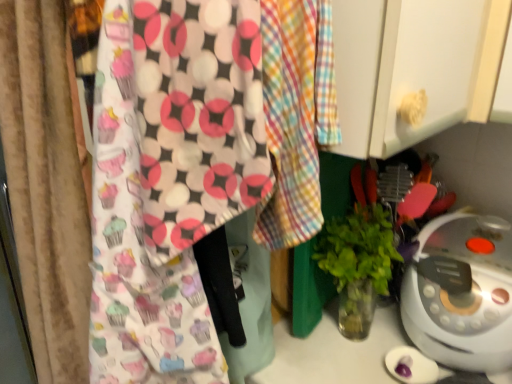
What do you see at coordinates (358, 264) in the screenshot? I see `green leafy plant in clear glass vase at center-right` at bounding box center [358, 264].

Based on the photo, what is the approximate height of white plastic rice cooker at lower right?

white plastic rice cooker at lower right is 10.87 inches in height.

Identify the location of cupcake-patterned fabric at center. The image size is (512, 384). (170, 178).

Is white plastic rice cooker at lower right to the left or to the right of cupcake-patterned fabric at center in the image?

Clearly, white plastic rice cooker at lower right is on the right of cupcake-patterned fabric at center in the image.

Would you consider white plastic rice cooker at lower right to be distant from cupcake-patterned fabric at center?

No, white plastic rice cooker at lower right is not far away from cupcake-patterned fabric at center.

Between white plastic rice cooker at lower right and cupcake-patterned fabric at center, which one is positioned behind?

white plastic rice cooker at lower right is further from the camera.

Considering the relative positions of cupcake-patterned fabric at center and white plastic rice cooker at lower right in the image provided, is cupcake-patterned fabric at center to the left of white plastic rice cooker at lower right from the viewer's perspective?

Indeed, cupcake-patterned fabric at center is positioned on the left side of white plastic rice cooker at lower right.

Which object is closer to the camera taking this photo, cupcake-patterned fabric at center or white plastic rice cooker at lower right?

Positioned in front is cupcake-patterned fabric at center.

Does cupcake-patterned fabric at center have a larger size compared to white plastic rice cooker at lower right?

Yes.

From the image's perspective, is cupcake-patterned fabric at center above or below white plastic rice cooker at lower right?

cupcake-patterned fabric at center is situated higher than white plastic rice cooker at lower right in the image.

Which is more to the right, green leafy plant in clear glass vase at center-right or cupcake-patterned fabric at center?

Positioned to the right is green leafy plant in clear glass vase at center-right.

From a real-world perspective, is green leafy plant in clear glass vase at center-right positioned under cupcake-patterned fabric at center based on gravity?

Yes, from a real-world perspective, green leafy plant in clear glass vase at center-right is below cupcake-patterned fabric at center.

I want to click on wrapping paper located in front of the green leafy plant in clear glass vase at center-right, so click(x=170, y=178).

In terms of width, does green leafy plant in clear glass vase at center-right look wider or thinner when compared to cupcake-patterned fabric at center?

Clearly, green leafy plant in clear glass vase at center-right has less width compared to cupcake-patterned fabric at center.

Between green leafy plant in clear glass vase at center-right and white plastic rice cooker at lower right, which one has more height?

green leafy plant in clear glass vase at center-right.

Does green leafy plant in clear glass vase at center-right appear on the right side of white plastic rice cooker at lower right?

No.

From the image's perspective, is green leafy plant in clear glass vase at center-right on top of white plastic rice cooker at lower right?

Yes.

Between white plastic rice cooker at lower right and green leafy plant in clear glass vase at center-right, which one has smaller width?

green leafy plant in clear glass vase at center-right.

Is white plastic rice cooker at lower right facing towards green leafy plant in clear glass vase at center-right?

No, white plastic rice cooker at lower right is not aimed at green leafy plant in clear glass vase at center-right.

Between cupcake-patterned fabric at center and green leafy plant in clear glass vase at center-right, which one has larger width?

cupcake-patterned fabric at center is wider.

Are cupcake-patterned fabric at center and green leafy plant in clear glass vase at center-right beside each other?

There is a gap between cupcake-patterned fabric at center and green leafy plant in clear glass vase at center-right.

Which is behind, cupcake-patterned fabric at center or green leafy plant in clear glass vase at center-right?

green leafy plant in clear glass vase at center-right is more distant.

Identify the location of wrapping paper lying on the left of white plastic rice cooker at lower right. (170, 178).

I want to click on home appliance located on the right of cupcake-patterned fabric at center, so click(461, 292).

Estimate the real-world distances between objects in this image. Which object is closer to green leafy plant in clear glass vase at center-right, white plastic rice cooker at lower right or cupcake-patterned fabric at center?

white plastic rice cooker at lower right is closer to green leafy plant in clear glass vase at center-right.

From the image, which object appears to be farther from white plastic rice cooker at lower right, green leafy plant in clear glass vase at center-right or cupcake-patterned fabric at center?

Among the two, cupcake-patterned fabric at center is located further to white plastic rice cooker at lower right.

Estimate the real-world distances between objects in this image. Which object is further from white plastic rice cooker at lower right, cupcake-patterned fabric at center or green leafy plant in clear glass vase at center-right?

cupcake-patterned fabric at center is further to white plastic rice cooker at lower right.

Which object lies further to the anchor point cupcake-patterned fabric at center, white plastic rice cooker at lower right or green leafy plant in clear glass vase at center-right?

Based on the image, white plastic rice cooker at lower right appears to be further to cupcake-patterned fabric at center.

Looking at the image, which one is located further to cupcake-patterned fabric at center, green leafy plant in clear glass vase at center-right or white plastic rice cooker at lower right?

white plastic rice cooker at lower right lies further to cupcake-patterned fabric at center than the other object.

From the picture: Estimate the real-world distances between objects in this image. Which object is closer to green leafy plant in clear glass vase at center-right, cupcake-patterned fabric at center or white plastic rice cooker at lower right?

white plastic rice cooker at lower right is positioned closer to the anchor green leafy plant in clear glass vase at center-right.

Find the location of a particular element. home appliance located between cupcake-patterned fabric at center and green leafy plant in clear glass vase at center-right in the depth direction is located at coordinates (461, 292).